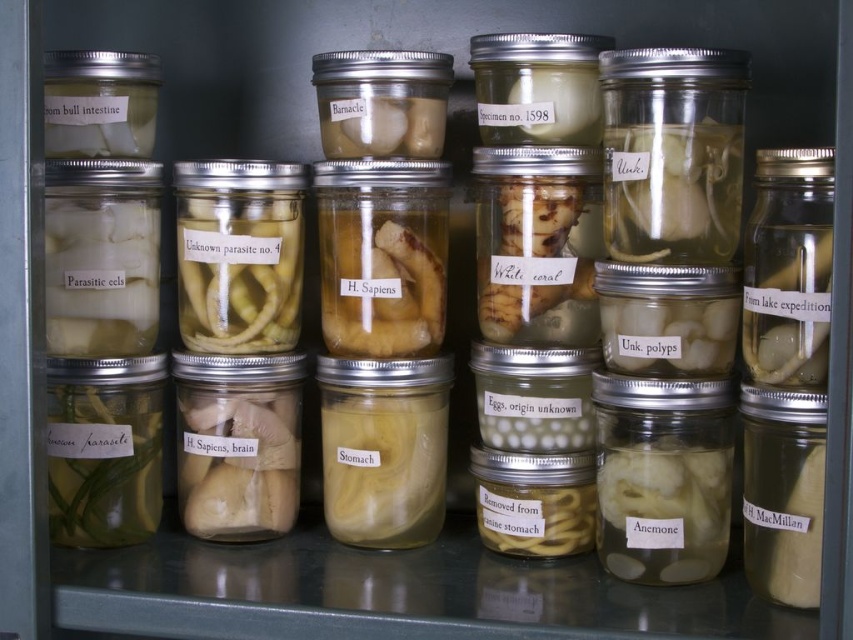
Question: Is translucent glass anemone at center-right closer to camera compared to green translucent parasite at lower left?

Choices:
 (A) no
 (B) yes

Answer: (B)

Question: Is translucent gelatinous substance at right to the right of translucent glass specimen at center from the viewer's perspective?

Choices:
 (A) yes
 (B) no

Answer: (A)

Question: Considering the real-world distances, which object is closest to the translucent glass anemone at center-right?

Choices:
 (A) translucent glass at upper center
 (B) translucent gelatinous unknown parasite at center
 (C) translucent gelatinous anemone at center
 (D) white translucent parasitic cells at center left

Answer: (C)

Question: Which of the following is the farthest from the observer?

Choices:
 (A) (228, 452)
 (B) (709, 80)
 (C) (358, 118)

Answer: (A)

Question: Which point is farther to the camera?

Choices:
 (A) (578, 310)
 (B) (184, 529)

Answer: (B)

Question: Is green translucent parasite at lower left positioned at the back of white translucent parasitic cells at center left?

Choices:
 (A) yes
 (B) no

Answer: (A)